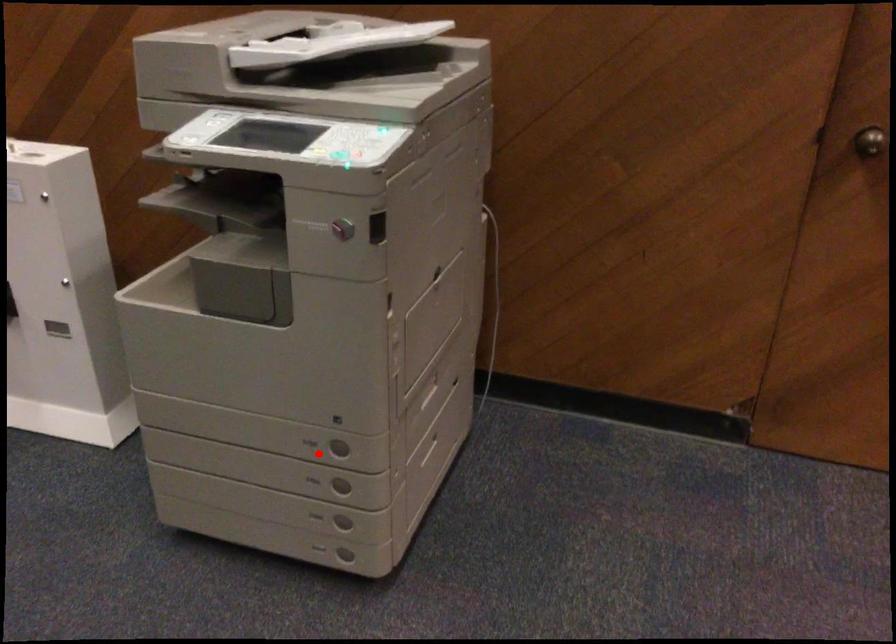
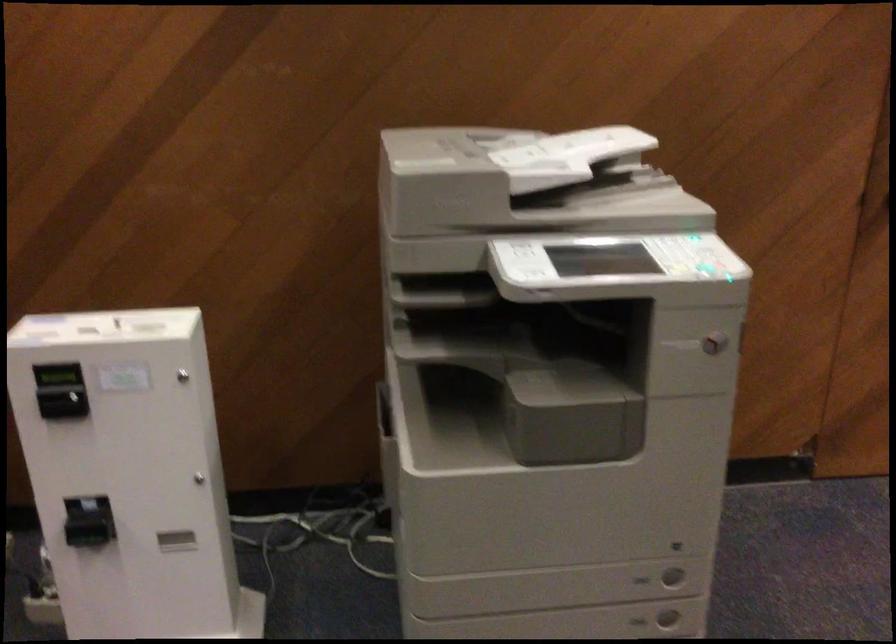
Where in the second image is the point corresponding to the highlighted location from the first image?

(642, 580)